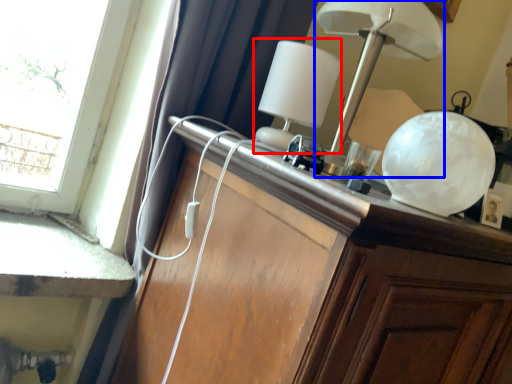
Question: Which of the following is the closest to the observer, table lamp (highlighted by a red box) or lamp (highlighted by a blue box)?

Choices:
 (A) table lamp
 (B) lamp

Answer: (B)